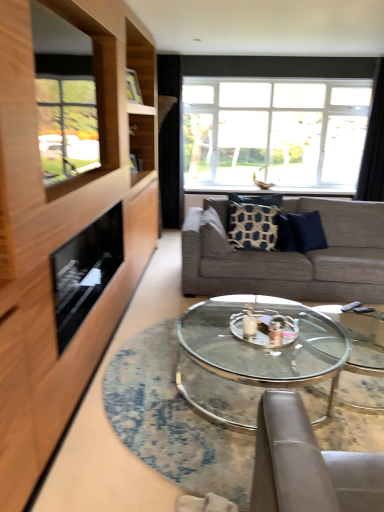
What is the approximate height of black fabric curtain at upper center, marked as the first curtain in a left-to-right arrangement?

black fabric curtain at upper center, marked as the first curtain in a left-to-right arrangement, is 2.30 meters tall.

This screenshot has width=384, height=512. Describe the element at coordinates (252, 224) in the screenshot. I see `blue textured pillow at center, the second pillow in the left-to-right sequence` at that location.

What do you see at coordinates (254, 358) in the screenshot? I see `transparent glass coffee table at center` at bounding box center [254, 358].

What is the approximate height of black fabric curtain at upper right, which is the second curtain from left to right?

The height of black fabric curtain at upper right, which is the second curtain from left to right, is 6.09 feet.

Find the location of a particular element. The width and height of the screenshot is (384, 512). transparent glass table at center is located at coordinates (172, 421).

Is point (376, 178) closer or farther from the camera than point (221, 245)?

Point (376, 178) is positioned farther from the camera compared to point (221, 245).

From a real-world perspective, which object stands above the other?

clear glass window at upper center, from a real-world perspective.

Does clear glass window at upper center touch patterned fabric pillow at center, positioned as the 2th pillow in right-to-left order?

They are not placed beside each other.

What's the angular difference between patterned fabric pillow at center, positioned as the 2th pillow in right-to-left order, and black fabric curtain at upper right, which is the second curtain from left to right,'s facing directions?

The facing directions of patterned fabric pillow at center, positioned as the 2th pillow in right-to-left order, and black fabric curtain at upper right, which is the second curtain from left to right, are 90.1 degrees apart.

From a real-world perspective, is patterned fabric pillow at center, marked as the first pillow in a left-to-right arrangement, positioned above or below black fabric curtain at upper right, marked as the first curtain in a right-to-left arrangement?

From a real-world perspective, patterned fabric pillow at center, marked as the first pillow in a left-to-right arrangement, is physically below black fabric curtain at upper right, marked as the first curtain in a right-to-left arrangement.

Is patterned fabric pillow at center, marked as the first pillow in a left-to-right arrangement, oriented away from black fabric curtain at upper right, which is the second curtain from left to right?

No, patterned fabric pillow at center, marked as the first pillow in a left-to-right arrangement, is not facing away from black fabric curtain at upper right, which is the second curtain from left to right.

Can you confirm if patterned fabric pillow at center, marked as the first pillow in a left-to-right arrangement, is wider than black fabric curtain at upper right, marked as the first curtain in a right-to-left arrangement?

Yes, patterned fabric pillow at center, marked as the first pillow in a left-to-right arrangement, is wider than black fabric curtain at upper right, marked as the first curtain in a right-to-left arrangement.

Based on their positions, is blue textured pillow at center, the second pillow in the left-to-right sequence, located to the left or right of textured gray couch at center?

Clearly, blue textured pillow at center, the second pillow in the left-to-right sequence, is on the left of textured gray couch at center in the image.

Which of these two, blue textured pillow at center, the second pillow in the left-to-right sequence, or textured gray couch at center, stands shorter?

Standing shorter between the two is blue textured pillow at center, the second pillow in the left-to-right sequence.

What are the coordinates of `the 2nd pillow above when counting from the textured gray couch at center (from the image's perspective)` in the screenshot? It's located at (252, 224).

Is blue textured pillow at center, arranged as the 1th pillow when viewed from the right, aimed at textured gray couch at center?

Yes, blue textured pillow at center, arranged as the 1th pillow when viewed from the right, faces towards textured gray couch at center.

This screenshot has height=512, width=384. Identify the location of window screen below the clear glass window at upper center (from the image's perspective). (83, 112).

How far apart are wooden frame at left and clear glass window at upper center?

A distance of 3.31 meters exists between wooden frame at left and clear glass window at upper center.

Considering the relative sizes of wooden frame at left and clear glass window at upper center in the image provided, is wooden frame at left thinner than clear glass window at upper center?

Yes, wooden frame at left is thinner than clear glass window at upper center.

From the image's perspective, would you say wooden frame at left is shown under clear glass window at upper center?

Indeed, from the image's perspective, wooden frame at left is shown beneath clear glass window at upper center.

Locate an element on the screen. The width and height of the screenshot is (384, 512). table that appears in front of the textured gray couch at center is located at coordinates (172, 421).

Can you confirm if textured gray couch at center is thinner than transparent glass table at center?

Correct, the width of textured gray couch at center is less than that of transparent glass table at center.

Is textured gray couch at center aimed at transparent glass table at center?

Yes, textured gray couch at center is facing transparent glass table at center.

Is textured gray couch at center next to transparent glass table at center and touching it?

textured gray couch at center is not next to transparent glass table at center, and they're not touching.

Consider the image. Which object is further away from the camera taking this photo, blue textured pillow at center, arranged as the 1th pillow when viewed from the right, or patterned fabric pillow at center, positioned as the 2th pillow in right-to-left order?

blue textured pillow at center, arranged as the 1th pillow when viewed from the right.

From a real-world perspective, is blue textured pillow at center, the second pillow in the left-to-right sequence, physically located above or below patterned fabric pillow at center, marked as the first pillow in a left-to-right arrangement?

blue textured pillow at center, the second pillow in the left-to-right sequence, is above patterned fabric pillow at center, marked as the first pillow in a left-to-right arrangement.

Is patterned fabric pillow at center, positioned as the 2th pillow in right-to-left order, inside blue textured pillow at center, arranged as the 1th pillow when viewed from the right?

That's incorrect, patterned fabric pillow at center, positioned as the 2th pillow in right-to-left order, is not inside blue textured pillow at center, arranged as the 1th pillow when viewed from the right.

At what (x,y) coordinates should I click in order to perform the action: click on pillow in front of the blue textured pillow at center, arranged as the 1th pillow when viewed from the right. Please return your answer as a coordinate pair (x, y). The image size is (384, 512). Looking at the image, I should click on (213, 234).

Consider the image. How many degrees apart are the facing directions of blue textured pillow at center, arranged as the 1th pillow when viewed from the right, and transparent glass coffee table at center?

The angular difference between blue textured pillow at center, arranged as the 1th pillow when viewed from the right, and transparent glass coffee table at center is 87.6 degrees.

Between blue textured pillow at center, the second pillow in the left-to-right sequence, and transparent glass coffee table at center, which one has larger size?

transparent glass coffee table at center.

From a real-world perspective, between blue textured pillow at center, arranged as the 1th pillow when viewed from the right, and transparent glass coffee table at center, who is vertically lower?

transparent glass coffee table at center is physically lower.

Locate an element on the screen. This screenshot has height=512, width=384. window that appears above the patterned fabric pillow at center, positioned as the 2th pillow in right-to-left order (from a real-world perspective) is located at coordinates (313, 77).

Locate an element on the screen. the 2nd pillow in front of the black fabric curtain at upper right, marked as the first curtain in a right-to-left arrangement is located at coordinates (213, 234).

Estimate the real-world distances between objects in this image. Which object is further from transparent glass table at center, wooden frame at left or textured gray couch at center?

Among the two, wooden frame at left is located further to transparent glass table at center.

When comparing their distances from patterned fabric pillow at center, positioned as the 2th pillow in right-to-left order, does black glass fireplace at left or transparent glass coffee table at center seem further?

The object further to patterned fabric pillow at center, positioned as the 2th pillow in right-to-left order, is black glass fireplace at left.

Considering their positions, is wooden frame at left positioned closer to transparent glass table at center than transparent glass coffee table at center?

transparent glass coffee table at center is positioned closer to the anchor transparent glass table at center.

Which object lies further to the anchor point blue textured pillow at center, the second pillow in the left-to-right sequence, black fabric curtain at upper right, marked as the first curtain in a right-to-left arrangement, or wooden frame at left?

The object further to blue textured pillow at center, the second pillow in the left-to-right sequence, is wooden frame at left.

When comparing their distances from blue textured pillow at center, arranged as the 1th pillow when viewed from the right, does textured gray couch at center or black glass fireplace at left seem closer?

Based on the image, textured gray couch at center appears to be nearer to blue textured pillow at center, arranged as the 1th pillow when viewed from the right.

Looking at the image, which one is located further to blue textured pillow at center, the second pillow in the left-to-right sequence, transparent glass coffee table at center or textured gray couch at center?

The object further to blue textured pillow at center, the second pillow in the left-to-right sequence, is transparent glass coffee table at center.

Looking at the image, which one is located closer to black fabric curtain at upper right, marked as the first curtain in a right-to-left arrangement, wooden frame at left or black fabric curtain at upper center, the 2th curtain when ordered from right to left?

Based on the image, black fabric curtain at upper center, the 2th curtain when ordered from right to left, appears to be nearer to black fabric curtain at upper right, marked as the first curtain in a right-to-left arrangement.

Considering their positions, is black fabric curtain at upper center, marked as the first curtain in a left-to-right arrangement, positioned closer to black fabric curtain at upper right, marked as the first curtain in a right-to-left arrangement, than transparent glass table at center?

black fabric curtain at upper center, marked as the first curtain in a left-to-right arrangement, is closer to black fabric curtain at upper right, marked as the first curtain in a right-to-left arrangement.

Image resolution: width=384 pixels, height=512 pixels. Find the location of `studio couch between transparent glass table at center and blue textured pillow at center, arranged as the 1th pillow when viewed from the right, in the front-back direction`. studio couch between transparent glass table at center and blue textured pillow at center, arranged as the 1th pillow when viewed from the right, in the front-back direction is located at coordinates (289, 255).

Image resolution: width=384 pixels, height=512 pixels. Identify the location of window screen between black glass fireplace at left and transparent glass coffee table at center from left to right. (83, 112).

I want to click on appliance located between transparent glass table at center and blue textured pillow at center, arranged as the 1th pillow when viewed from the right, in the depth direction, so click(x=85, y=271).

At what (x,y) coordinates should I click in order to perform the action: click on table between wooden frame at left and black fabric curtain at upper right, marked as the first curtain in a right-to-left arrangement, from front to back. Please return your answer as a coordinate pair (x, y). This screenshot has height=512, width=384. Looking at the image, I should click on [172, 421].